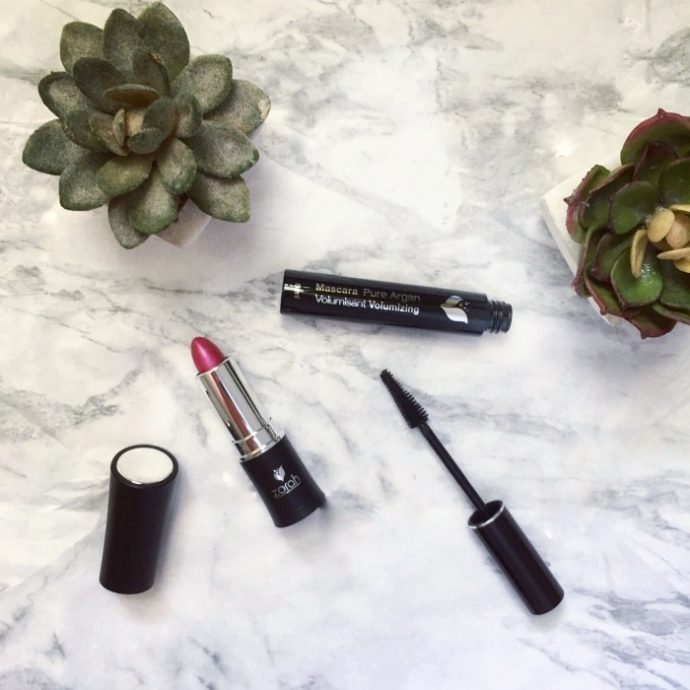
The width and height of the screenshot is (690, 690). Find the location of `white part of countertop`. white part of countertop is located at coordinates (582, 23).